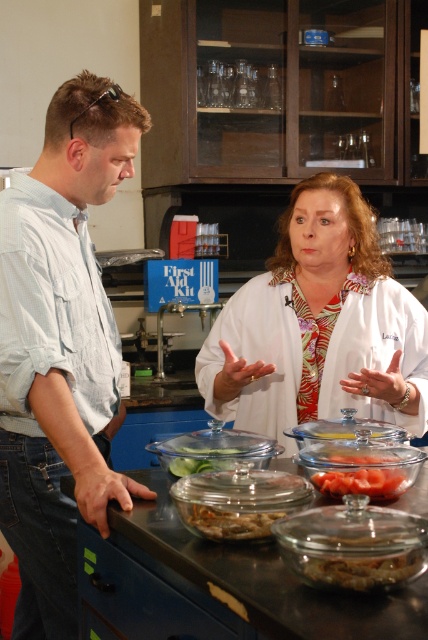
Question: Is white glossy lab coat at center thinner than translucent glass bowl at center?

Choices:
 (A) no
 (B) yes

Answer: (A)

Question: Which point appears closest to the camera in this image?

Choices:
 (A) (329, 484)
 (B) (371, 560)
 (C) (101, 605)

Answer: (B)

Question: In this image, where is black granite counter at center located relative to brown matte food at center?

Choices:
 (A) below
 (B) above

Answer: (A)

Question: Which point is farther to the camera?

Choices:
 (A) (104, 328)
 (B) (392, 484)
 (C) (163, 528)
 (D) (258, 518)

Answer: (A)

Question: Is black granite counter at center above translucent glass bowl at lower center?

Choices:
 (A) no
 (B) yes

Answer: (A)

Question: Which of the following is the closest to the observer?

Choices:
 (A) (318, 566)
 (B) (136, 593)
 (C) (279, 250)
 (D) (9, 321)

Answer: (A)